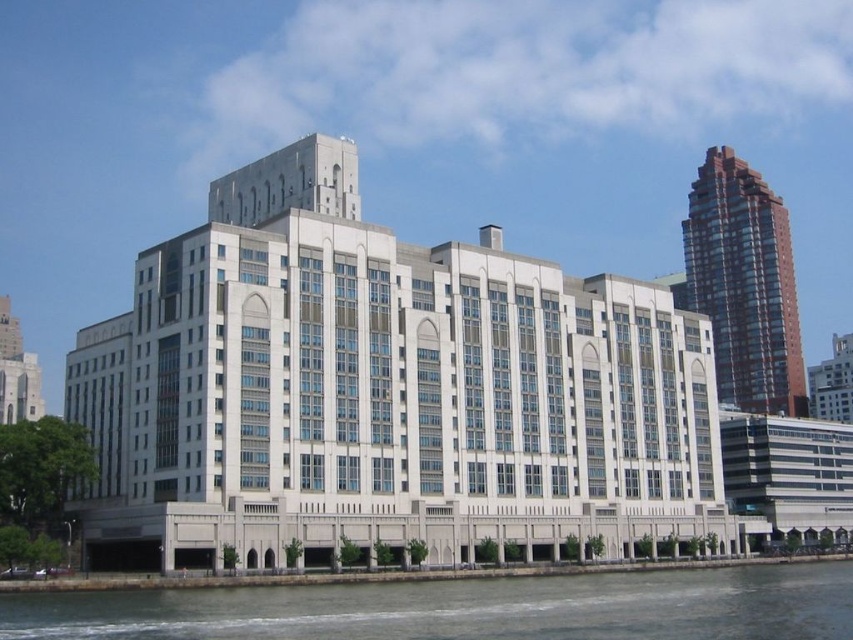
Question: Considering the relative positions of gray water at lower center and brown glassy tower at upper right in the image provided, where is gray water at lower center located with respect to brown glassy tower at upper right?

Choices:
 (A) below
 (B) above

Answer: (A)

Question: Which of these objects is positioned farthest from the gray water at lower center?

Choices:
 (A) brown glassy tower at upper right
 (B) white stone building at center

Answer: (A)

Question: Does gray water at lower center come in front of brown glassy tower at upper right?

Choices:
 (A) yes
 (B) no

Answer: (A)

Question: Which point is closer to the camera taking this photo?

Choices:
 (A) (300, 596)
 (B) (250, 346)

Answer: (A)

Question: Which object is farther from the camera taking this photo?

Choices:
 (A) gray water at lower center
 (B) brown glassy tower at upper right

Answer: (B)

Question: Where is white stone building at center located in relation to brown glassy tower at upper right in the image?

Choices:
 (A) left
 (B) right

Answer: (A)